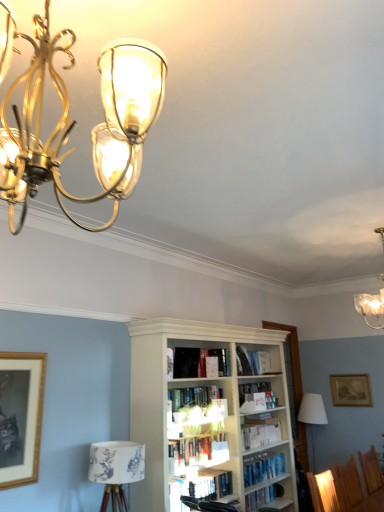
Find the location of a particular element. This screenshot has height=512, width=384. free spot above hardcover books at center, which is the third book from bottom to top (from a real-world perspective) is located at coordinates click(x=204, y=433).